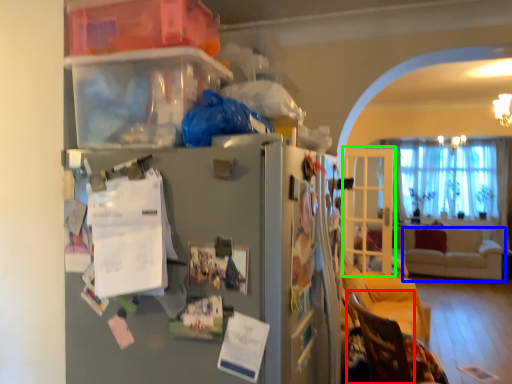
Question: Based on their relative distances, which object is farther from armchair (highlighted by a red box)? Choose from studio couch (highlighted by a blue box) and glass door (highlighted by a green box).

Choices:
 (A) studio couch
 (B) glass door

Answer: (A)